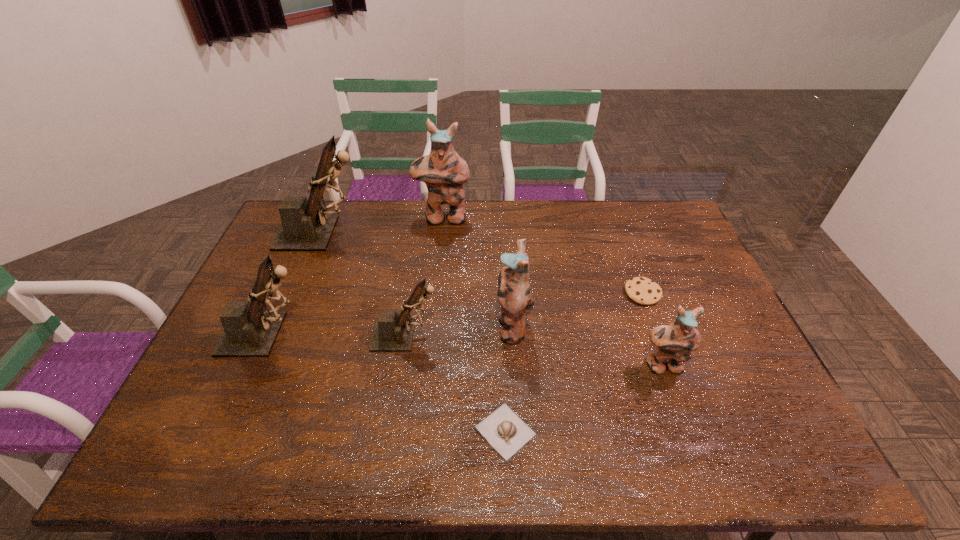
Where is `vacant space that satisfies the following two spatial constraints: 1. on the front-facing side of the farthest brown figurine; 2. on the left side of the brown cookie`? This screenshot has height=540, width=960. vacant space that satisfies the following two spatial constraints: 1. on the front-facing side of the farthest brown figurine; 2. on the left side of the brown cookie is located at coordinates (299, 293).